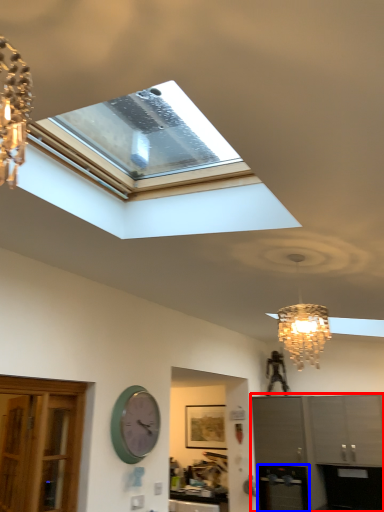
Question: Among these objects, which one is nearest to the camera, cabinetry (highlighted by a red box) or appliance (highlighted by a blue box)?

Choices:
 (A) cabinetry
 (B) appliance

Answer: (A)